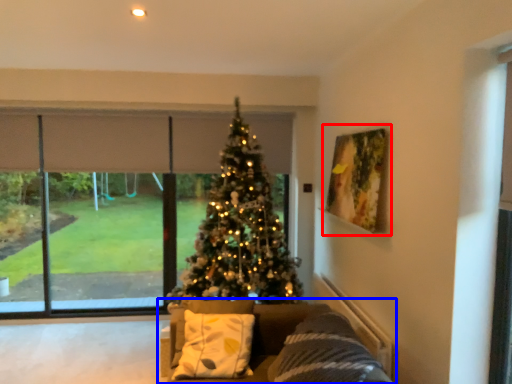
Question: Which object is closer to the camera taking this photo, picture frame (highlighted by a red box) or studio couch (highlighted by a blue box)?

Choices:
 (A) picture frame
 (B) studio couch

Answer: (B)